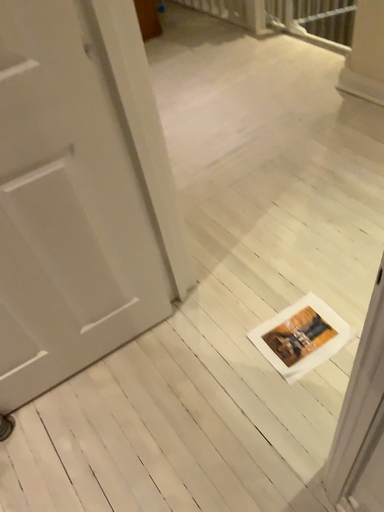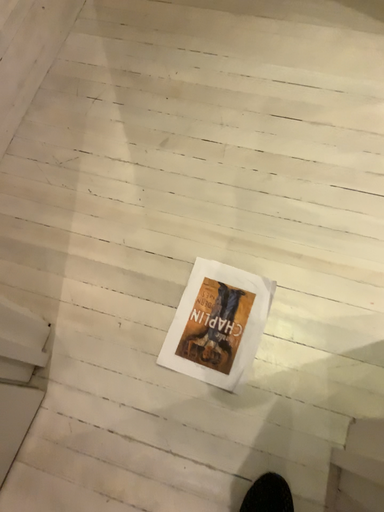
Question: How did the camera likely rotate when shooting the video?

Choices:
 (A) rotated upward
 (B) rotated downward

Answer: (B)